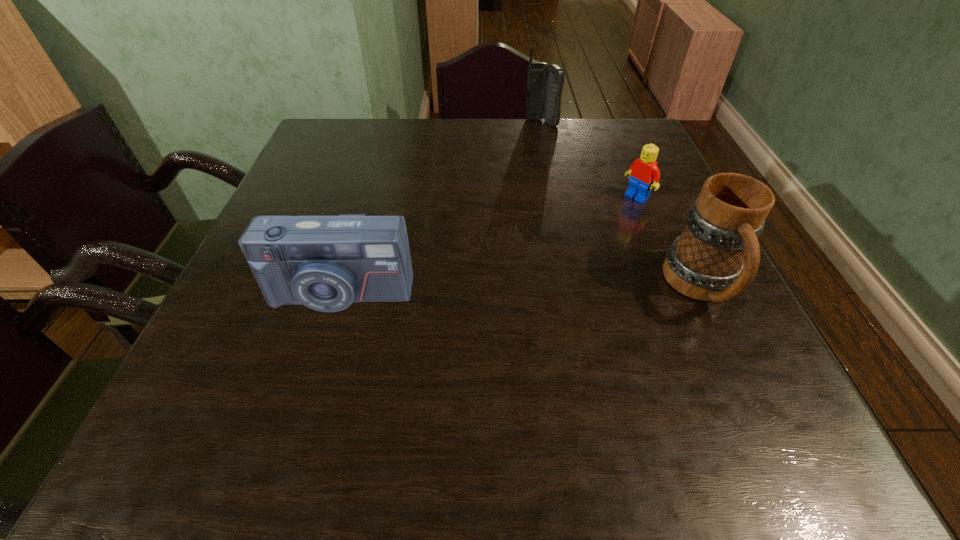
The image size is (960, 540). Identify the location of free space that is in between the camera and the shortest object. (488, 245).

Identify the location of empty space that is in between the third object from right to left and the mug. (621, 205).

The height and width of the screenshot is (540, 960). Identify the location of free area in between the third nearest object and the camera. (488, 245).

Find the location of a particular element. The image size is (960, 540). the second closest object to the leftmost object is located at coordinates (644, 174).

Choose which object is the nearest neighbor to the cellular telephone. Please provide its 2D coordinates. Your answer should be formatted as a tuple, i.e. [(x, y)], where the tuple contains the x and y coordinates of a point satisfying the conditions above.

[(644, 174)]

Where is `free location that satisfies the following two spatial constraints: 1. on the front side of the shortest object; 2. on the right side of the second object from left to right`? free location that satisfies the following two spatial constraints: 1. on the front side of the shortest object; 2. on the right side of the second object from left to right is located at coordinates (557, 197).